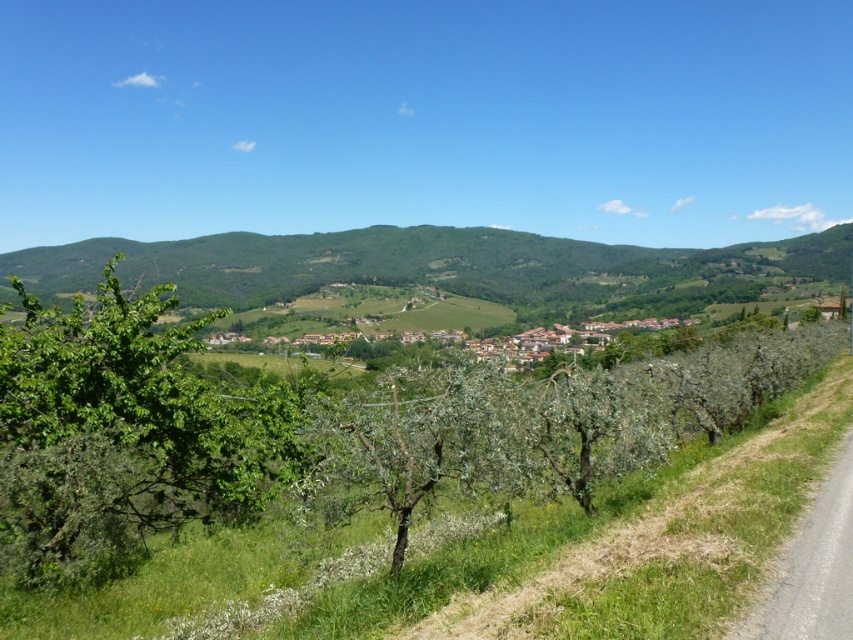
You are standing at the point with coordinates (x=122, y=435) in the image. What object is exactly at this location?

The green leafy tree at left is exactly at point (x=122, y=435).

You are a hiker standing on the dirt path in the foreground of the image. You see the green leafy tree at left and the green leafy hillside at center. Which object is closer to you?

The green leafy tree at left is closer to you because it is positioned under the green leafy hillside at center, indicating it is in the foreground.

You are standing at the dirt path in the scene and want to walk towards the green leafy hillside at center. Which direction should you walk to get closer to it without passing the green leafy tree at left?

To reach the green leafy hillside at center without passing the green leafy tree at left, you should walk away from the green leafy tree at left since it is closer to you than the hillside.